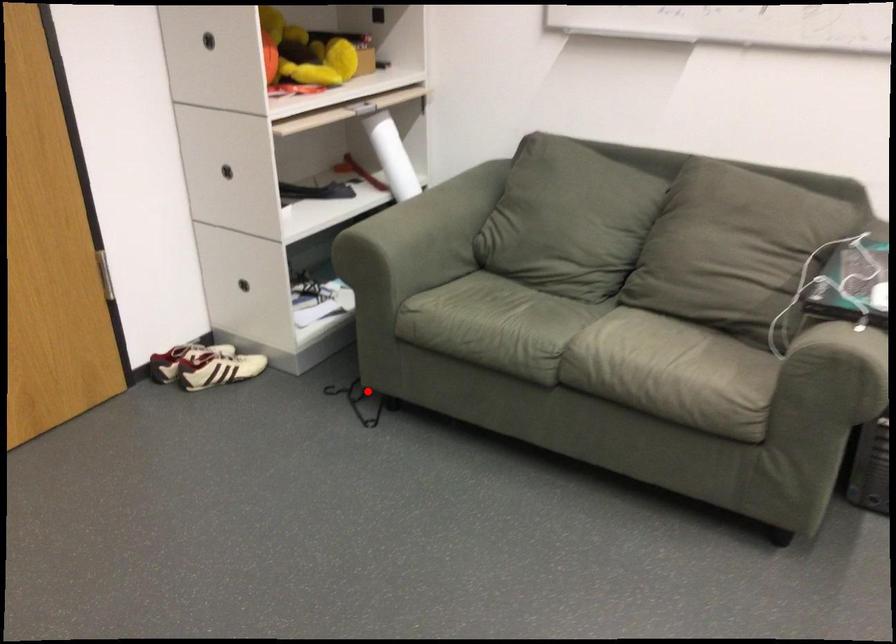
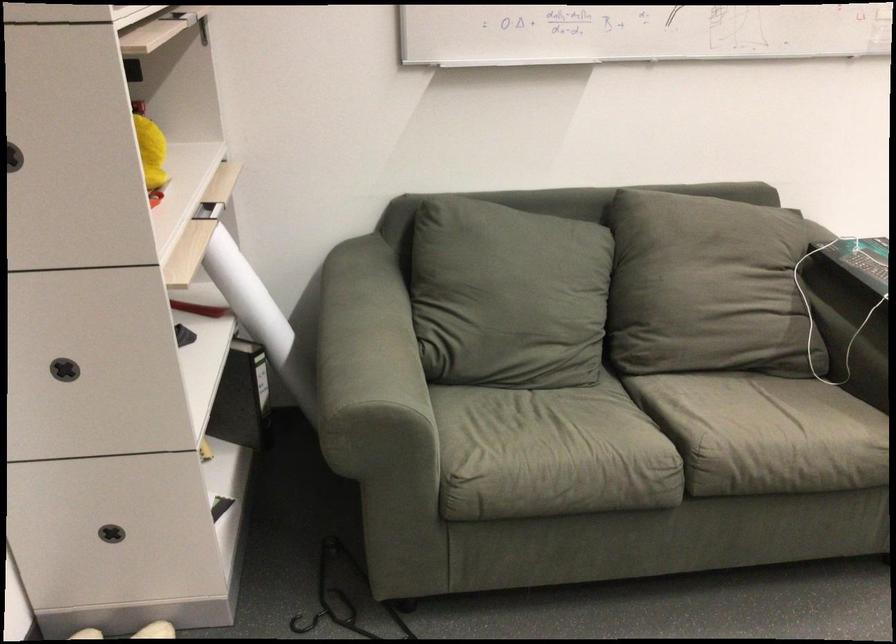
Question: I am providing you with two images of the same scene from different viewpoints. In image1, a red point is highlighted. Considering the same 3D point in image2, which of the following is correct?

Choices:
 (A) It is closer
 (B) It is farther

Answer: (A)